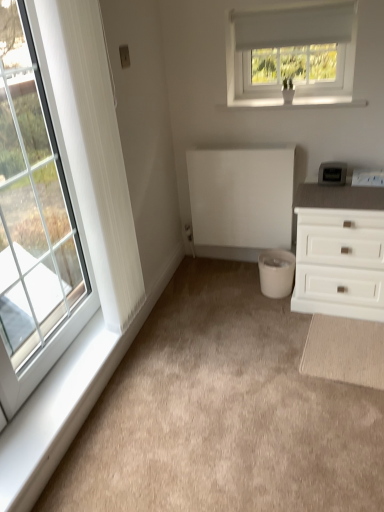
Question: Can you confirm if beige carpet at center is wider than white plastic window sill at lower left, the first window sill when ordered from left to right?

Choices:
 (A) no
 (B) yes

Answer: (B)

Question: From the image's perspective, does beige carpet at center appear higher than white plastic window sill at lower left, the second window sill positioned from the top?

Choices:
 (A) no
 (B) yes

Answer: (B)

Question: Is beige carpet at center at the right side of white plastic window sill at lower left, the second window sill positioned from the top?

Choices:
 (A) no
 (B) yes

Answer: (B)

Question: Is beige carpet at center oriented away from white plastic window sill at lower left, positioned as the second window sill in right-to-left order?

Choices:
 (A) yes
 (B) no

Answer: (B)

Question: From a real-world perspective, is beige carpet at center located higher than white plastic window sill at lower left, positioned as the second window sill in right-to-left order?

Choices:
 (A) yes
 (B) no

Answer: (B)

Question: From their relative heights in the image, would you say beige carpet at center is taller or shorter than white plastic window sill at lower left, the second window sill positioned from the top?

Choices:
 (A) short
 (B) tall

Answer: (B)

Question: From a real-world perspective, is beige carpet at center positioned above or below white plastic window sill at lower left, the second window sill positioned from the top?

Choices:
 (A) below
 (B) above

Answer: (A)

Question: From the image's perspective, is beige carpet at center located above or below white plastic window sill at lower left, the first window sill when ordered from left to right?

Choices:
 (A) below
 (B) above

Answer: (B)

Question: Would you say beige carpet at center is inside or outside white plastic window sill at lower left, which is the first window sill from bottom to top?

Choices:
 (A) outside
 (B) inside

Answer: (A)

Question: Considering the relative positions of white glass window at left, the 1th window in the left-to-right sequence, and white plastic window sill at lower left, which is the first window sill from bottom to top, in the image provided, is white glass window at left, the 1th window in the left-to-right sequence, to the left or to the right of white plastic window sill at lower left, which is the first window sill from bottom to top,?

Choices:
 (A) left
 (B) right

Answer: (A)

Question: Relative to white plastic window sill at lower left, the first window sill when ordered from left to right, is white glass window at left, positioned as the first window in bottom-to-top order, in front or behind?

Choices:
 (A) front
 (B) behind

Answer: (A)

Question: Is white glass window at left, the 2th window in the top-to-bottom sequence, situated inside white plastic window sill at lower left, which is the first window sill from bottom to top, or outside?

Choices:
 (A) outside
 (B) inside

Answer: (A)

Question: From the image's perspective, is white glass window at left, the second window from the right, located above or below white plastic window sill at lower left, the second window sill positioned from the top?

Choices:
 (A) above
 (B) below

Answer: (A)

Question: Considering the positions of white glass window at left, positioned as the first window in bottom-to-top order, and white matte radiator at center in the image, is white glass window at left, positioned as the first window in bottom-to-top order, wider or thinner than white matte radiator at center?

Choices:
 (A) thin
 (B) wide

Answer: (A)

Question: Choose the correct answer: Is white glass window at left, positioned as the first window in bottom-to-top order, inside white matte radiator at center or outside it?

Choices:
 (A) inside
 (B) outside

Answer: (B)